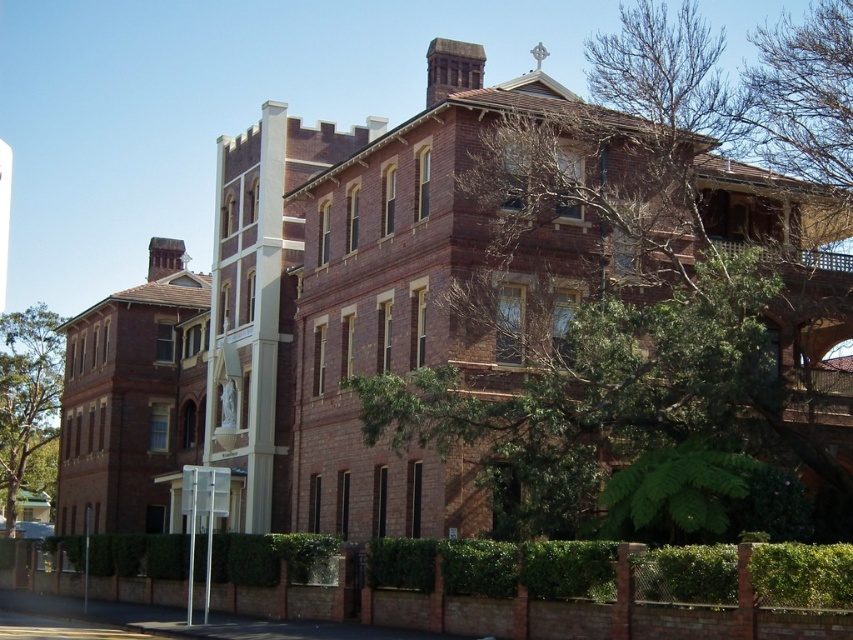
Which of these two, green leafy tree at upper right or white glossy pole at center, stands taller?

Standing taller between the two is green leafy tree at upper right.

Does green leafy tree at upper right have a lesser height compared to white glossy pole at center?

In fact, green leafy tree at upper right may be taller than white glossy pole at center.

Is point (672, 148) closer to camera compared to point (190, 544)?

No.

This screenshot has width=853, height=640. Find the location of `green leafy tree at upper right`. green leafy tree at upper right is located at coordinates (646, 253).

Which of these two, green leafy tree at upper right or green leafy tree at lower left, stands shorter?

green leafy tree at lower left is shorter.

The width and height of the screenshot is (853, 640). Describe the element at coordinates (646, 253) in the screenshot. I see `green leafy tree at upper right` at that location.

Which is behind, point (595, 348) or point (6, 477)?

The point (6, 477) is behind.

You are a GUI agent. You are given a task and a screenshot of the screen. Output one action in this format:
    pyautogui.click(x=<x>, y=<y>)
    Task: Click on the green leafy tree at upper right
    Image resolution: width=853 pixels, height=640 pixels.
    Given the screenshot: What is the action you would take?
    (x=646, y=253)

Can you confirm if green leafy tree at lower left is positioned to the right of metallic pole at lower left?

In fact, green leafy tree at lower left is to the left of metallic pole at lower left.

Can you confirm if green leafy tree at lower left is positioned below metallic pole at lower left?

Actually, green leafy tree at lower left is above metallic pole at lower left.

Who is more forward, [38,397] or [85,609]?

Point [85,609] is in front.

You are a GUI agent. You are given a task and a screenshot of the screen. Output one action in this format:
    pyautogui.click(x=<x>, y=<y>)
    Task: Click on the green leafy tree at lower left
    
    Given the screenshot: What is the action you would take?
    pyautogui.click(x=26, y=394)